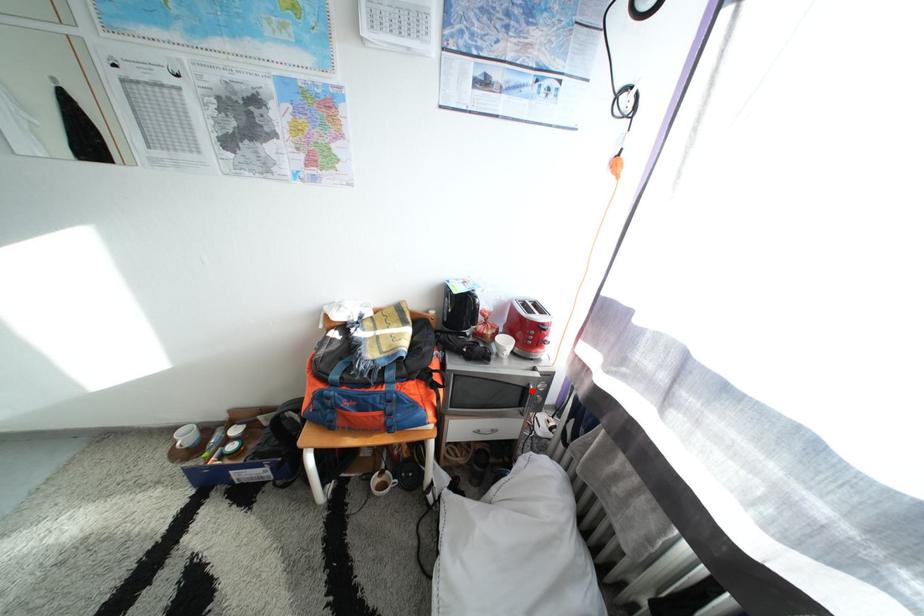
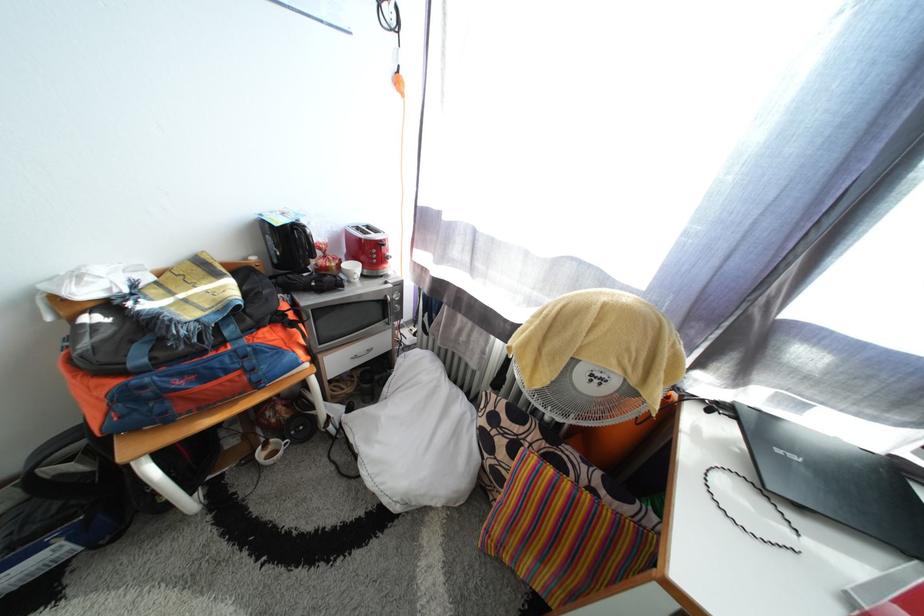
In the second image, find the point that corresponds to the highlighted location in the first image.

(390, 304)